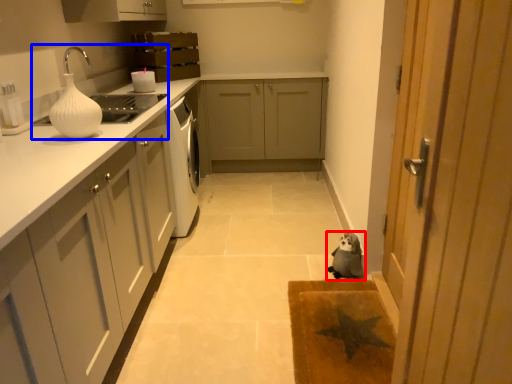
Question: Which object is closer to the camera taking this photo, dog (highlighted by a red box) or sink (highlighted by a blue box)?

Choices:
 (A) dog
 (B) sink

Answer: (B)